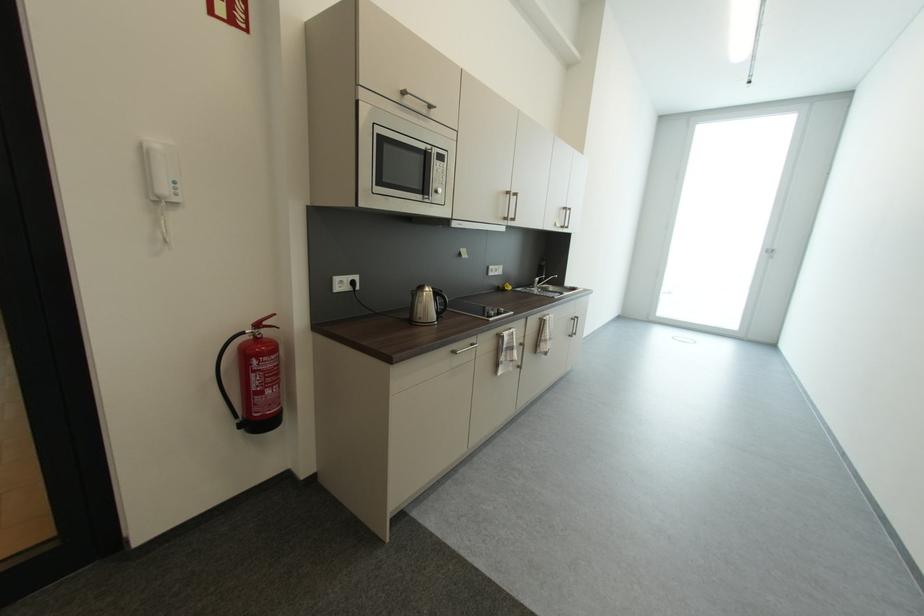
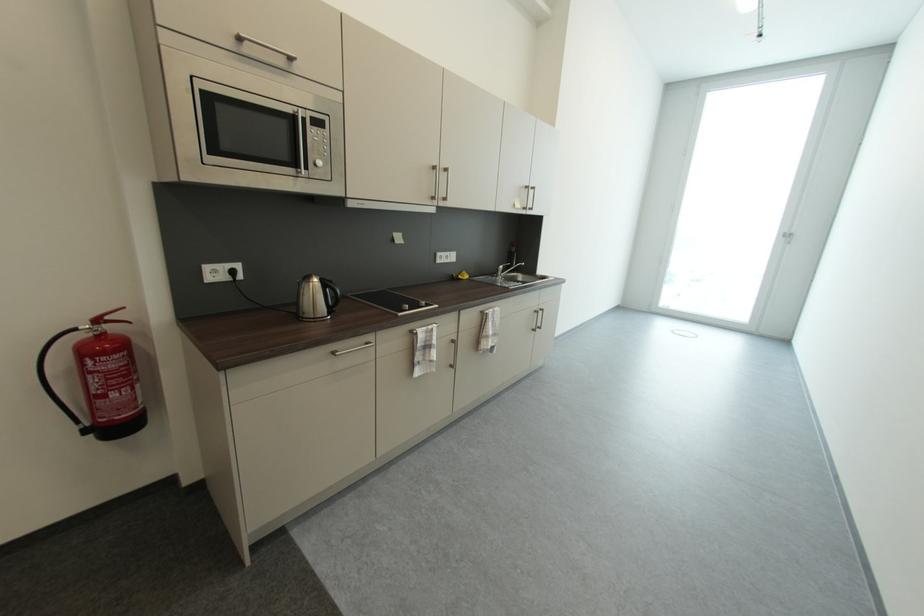
The point at [578,321] is marked in the first image. Where is the corresponding point in the second image?

(541, 313)